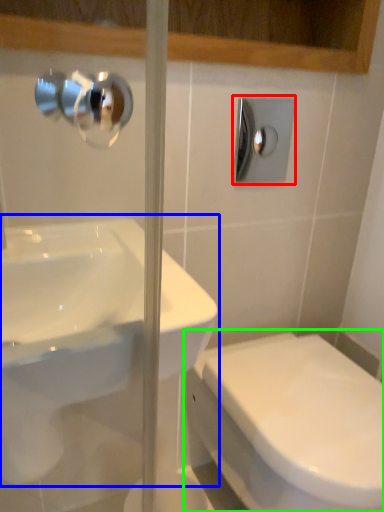
Question: Which object is the farthest from shower (highlighted by a red box)? Choose among these: sink (highlighted by a blue box) or toilet (highlighted by a green box).

Choices:
 (A) sink
 (B) toilet

Answer: (B)